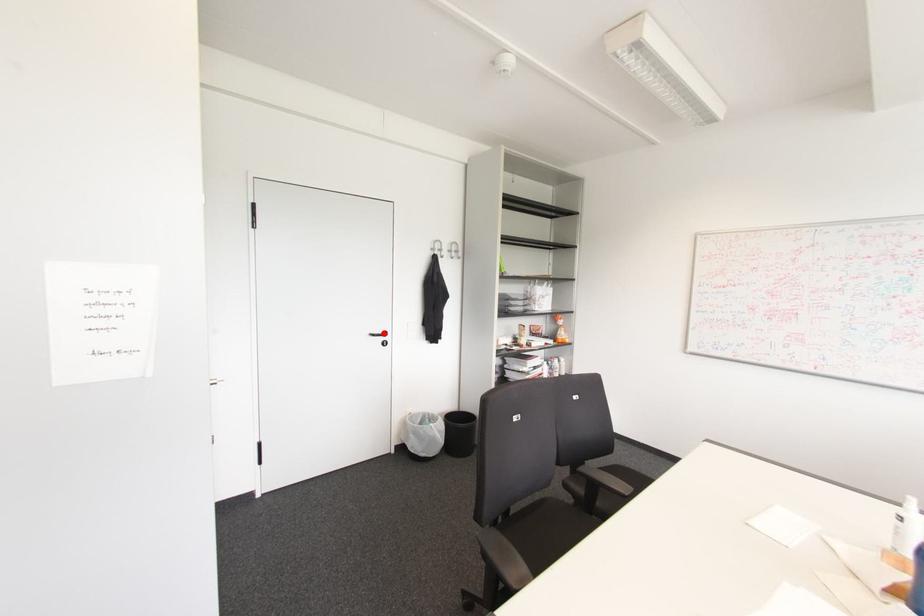
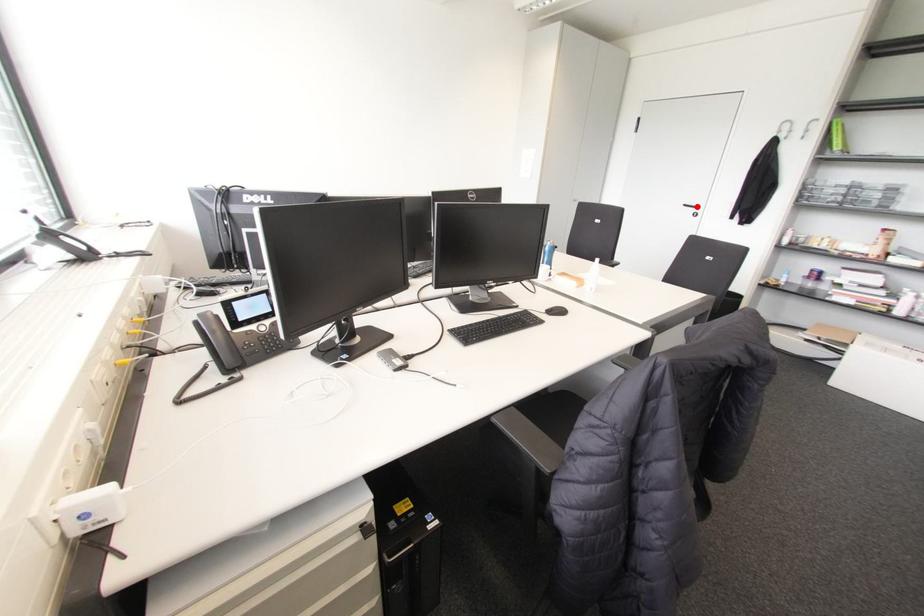
I am providing you with two images of the same scene from different viewpoints. A red point is marked on the first image and another point is marked on the second image. Is the red point in image1 aligned with the point shown in image2?

Yes